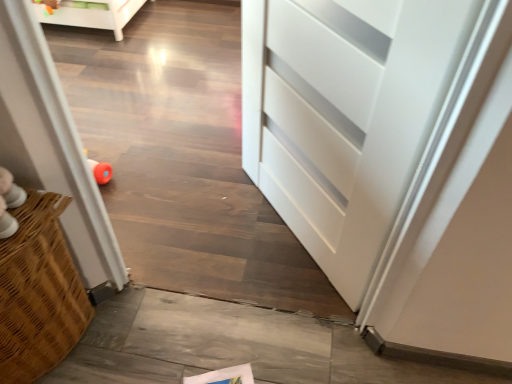
Locate an element on the screen. This screenshot has width=512, height=384. white glossy screen door at left is located at coordinates 51,145.

The height and width of the screenshot is (384, 512). Describe the element at coordinates (51, 145) in the screenshot. I see `white glossy screen door at left` at that location.

What do you see at coordinates (48, 5) in the screenshot? The height and width of the screenshot is (384, 512). I see `multicolored plastic toy at upper left` at bounding box center [48, 5].

Where is `multicolored plastic toy at upper left`? multicolored plastic toy at upper left is located at coordinates (48, 5).

This screenshot has width=512, height=384. I want to click on white glossy screen door at left, so click(x=51, y=145).

Is multicolored plastic toy at upper left at the left side of white glossy screen door at left?

Yes, multicolored plastic toy at upper left is to the left of white glossy screen door at left.

Considering their positions, is multicolored plastic toy at upper left located in front of or behind white glossy screen door at left?

Clearly, multicolored plastic toy at upper left is behind white glossy screen door at left.

Between point (51, 2) and point (68, 192), which one is positioned behind?

Point (51, 2)

From the image's perspective, who appears lower, multicolored plastic toy at upper left or white glossy screen door at left?

white glossy screen door at left is shown below in the image.

From a real-world perspective, which object rests below the other?

multicolored plastic toy at upper left is physically lower.

Looking at their sizes, would you say multicolored plastic toy at upper left is wider or thinner than white glossy screen door at left?

Result: Clearly, multicolored plastic toy at upper left has less width compared to white glossy screen door at left.

Considering the sizes of objects multicolored plastic toy at upper left and white glossy screen door at left in the image provided, who is taller, multicolored plastic toy at upper left or white glossy screen door at left?

white glossy screen door at left is taller.

Considering the relative sizes of multicolored plastic toy at upper left and white glossy screen door at left in the image provided, is multicolored plastic toy at upper left bigger than white glossy screen door at left?

Incorrect, multicolored plastic toy at upper left is not larger than white glossy screen door at left.

Is white glossy screen door at left completely or partially inside multicolored plastic toy at upper left?

No, multicolored plastic toy at upper left does not contain white glossy screen door at left.

Would you say multicolored plastic toy at upper left is a long distance from white glossy screen door at left?

That's right, there is a large distance between multicolored plastic toy at upper left and white glossy screen door at left.

Based on the photo, is multicolored plastic toy at upper left aimed at white glossy screen door at left?

No, multicolored plastic toy at upper left is not oriented towards white glossy screen door at left.

How many degrees apart are the facing directions of multicolored plastic toy at upper left and white glossy screen door at left?

multicolored plastic toy at upper left and white glossy screen door at left are facing 173 degrees away from each other.

How distant is multicolored plastic toy at upper left from white glossy screen door at left?

1.99 meters.

I want to click on toy lying on the left of white glossy screen door at left, so click(48, 5).

Which is more to the left, white glossy screen door at left or multicolored plastic toy at upper left?

multicolored plastic toy at upper left.

Which object is closer to the camera taking this photo, white glossy screen door at left or multicolored plastic toy at upper left?

Positioned in front is white glossy screen door at left.

Which point is more distant from viewer, (59, 81) or (44, 3)?

Positioned behind is point (44, 3).

From the image's perspective, is white glossy screen door at left above multicolored plastic toy at upper left?

No, from the image's perspective, white glossy screen door at left is not above multicolored plastic toy at upper left.

From a real-world perspective, who is located lower, white glossy screen door at left or multicolored plastic toy at upper left?

From a 3D spatial view, multicolored plastic toy at upper left is below.

Can you confirm if white glossy screen door at left is wider than multicolored plastic toy at upper left?

Yes, white glossy screen door at left is wider than multicolored plastic toy at upper left.

From their relative heights in the image, would you say white glossy screen door at left is taller or shorter than multicolored plastic toy at upper left?

Considering their sizes, white glossy screen door at left has more height than multicolored plastic toy at upper left.

Considering the sizes of objects white glossy screen door at left and multicolored plastic toy at upper left in the image provided, who is smaller, white glossy screen door at left or multicolored plastic toy at upper left?

With smaller size is multicolored plastic toy at upper left.

Is white glossy screen door at left located outside multicolored plastic toy at upper left?

white glossy screen door at left lies outside multicolored plastic toy at upper left's area.

Are white glossy screen door at left and multicolored plastic toy at upper left far apart?

Absolutely, white glossy screen door at left is distant from multicolored plastic toy at upper left.

Does white glossy screen door at left turn towards multicolored plastic toy at upper left?

No, white glossy screen door at left is not facing towards multicolored plastic toy at upper left.

What's the angular difference between white glossy screen door at left and multicolored plastic toy at upper left's facing directions?

There is a 173-degree angle between the facing directions of white glossy screen door at left and multicolored plastic toy at upper left.

How distant is white glossy screen door at left from multicolored plastic toy at upper left?

white glossy screen door at left is 6.52 feet from multicolored plastic toy at upper left.

Where is `screen door below the multicolored plastic toy at upper left (from the image's perspective)`? Image resolution: width=512 pixels, height=384 pixels. screen door below the multicolored plastic toy at upper left (from the image's perspective) is located at coordinates (51, 145).

At what (x,y) coordinates should I click in order to perform the action: click on toy that is above the white glossy screen door at left (from the image's perspective). Please return your answer as a coordinate pair (x, y). The width and height of the screenshot is (512, 384). Looking at the image, I should click on (48, 5).

The width and height of the screenshot is (512, 384). I want to click on screen door that is on the right side of multicolored plastic toy at upper left, so click(x=51, y=145).